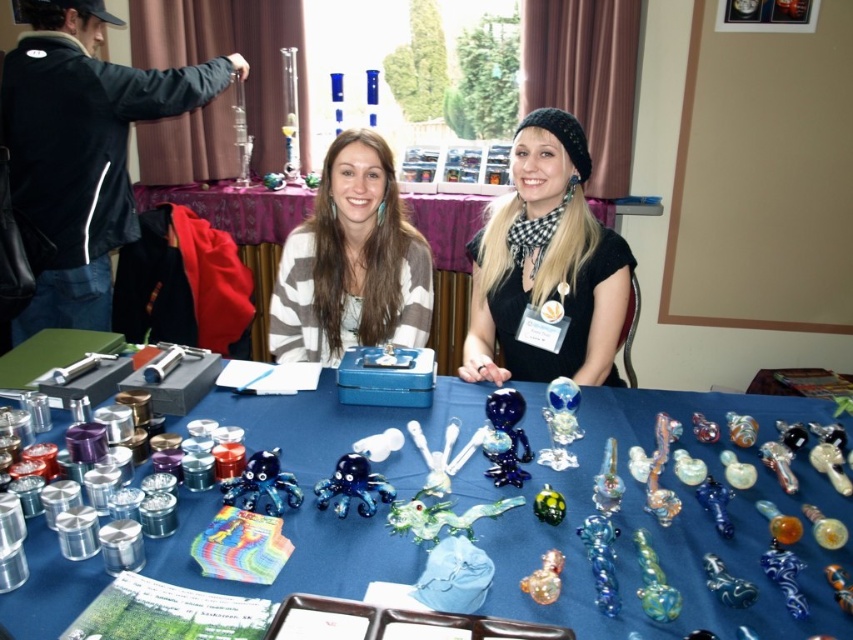
Question: Estimate the real-world distances between objects in this image. Which object is closer to the blue glass pipe at center?

Choices:
 (A) black matte scarf at upper center
 (B) blue fabric tablecloth at center

Answer: (A)

Question: Can you confirm if black matte scarf at upper center is positioned to the right of blue fabric tablecloth at center?

Choices:
 (A) yes
 (B) no

Answer: (A)

Question: Is the position of blue glass pipe at center less distant than that of blue fabric tablecloth at center?

Choices:
 (A) yes
 (B) no

Answer: (A)

Question: Estimate the real-world distances between objects in this image. Which object is closer to the blue glass pipe at center?

Choices:
 (A) black matte scarf at upper center
 (B) blue fabric tablecloth at center
 (C) white striped sweater at center

Answer: (A)

Question: Which point is closer to the camera?

Choices:
 (A) (347, 205)
 (B) (554, 365)

Answer: (B)

Question: Does blue glass pipe at center have a lesser width compared to black matte scarf at upper center?

Choices:
 (A) yes
 (B) no

Answer: (B)